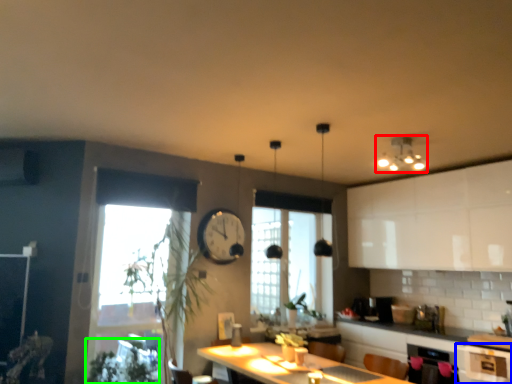
Question: Which object is the farthest from light fixture (highlighted by a red box)? Choose among these: cabinetry (highlighted by a blue box) or plant (highlighted by a green box).

Choices:
 (A) cabinetry
 (B) plant

Answer: (B)